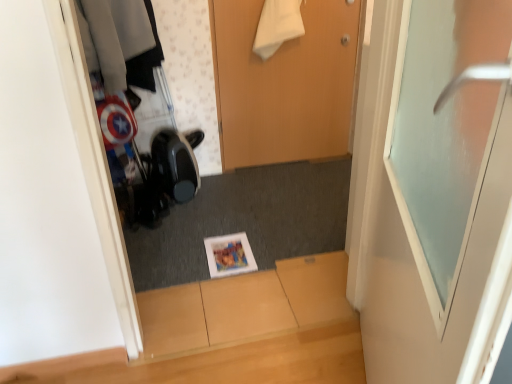
Where is `vacant space that is in between wooden door at center, which is the first door in back-to-front order, and matte paper magazine at center`? The width and height of the screenshot is (512, 384). vacant space that is in between wooden door at center, which is the first door in back-to-front order, and matte paper magazine at center is located at coordinates (272, 203).